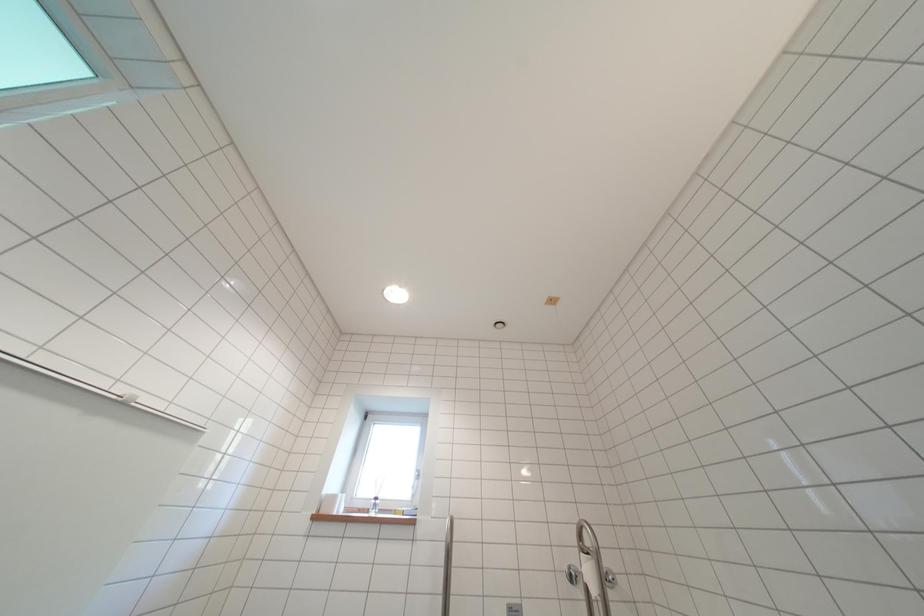
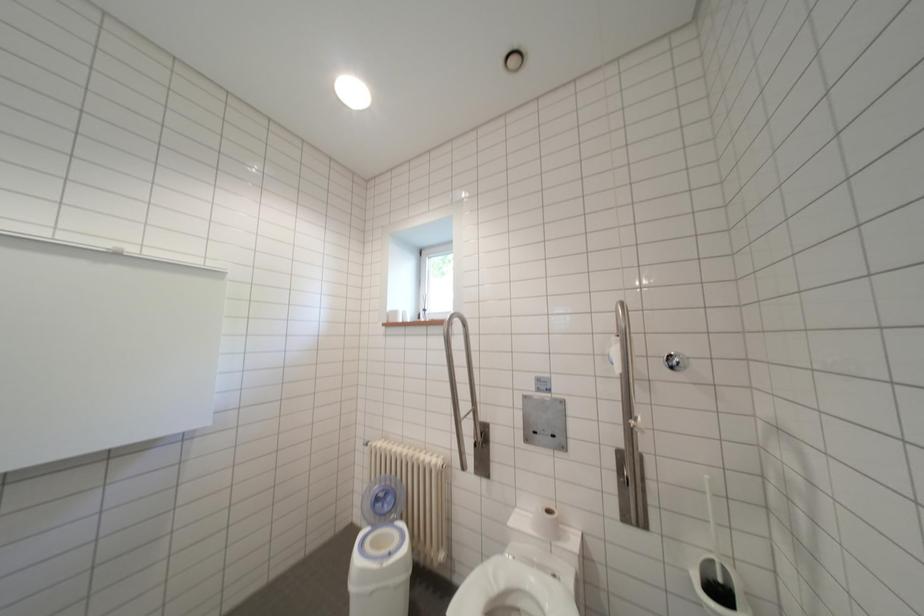
Based on the continuous images, in which direction is the camera rotating?

The camera rotated toward left-down.